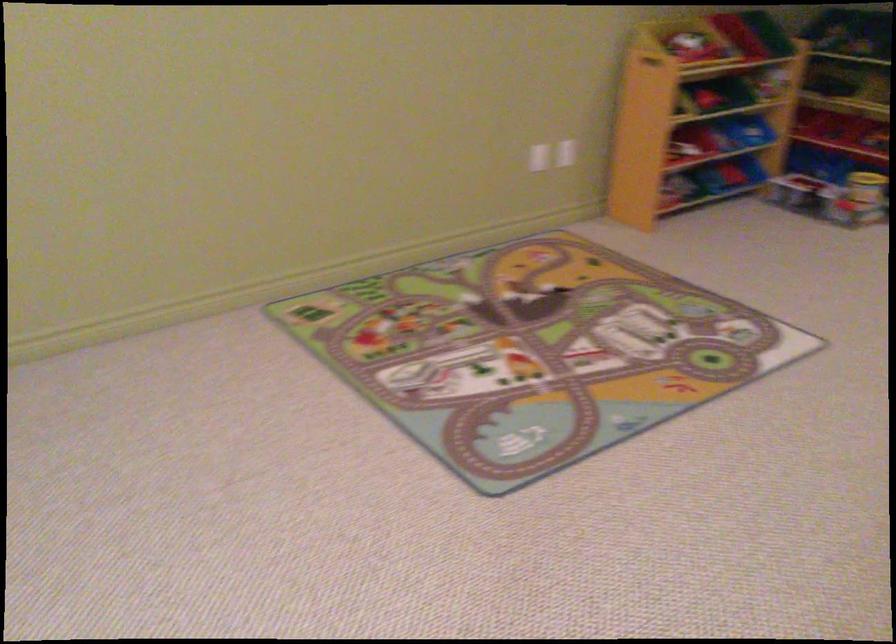
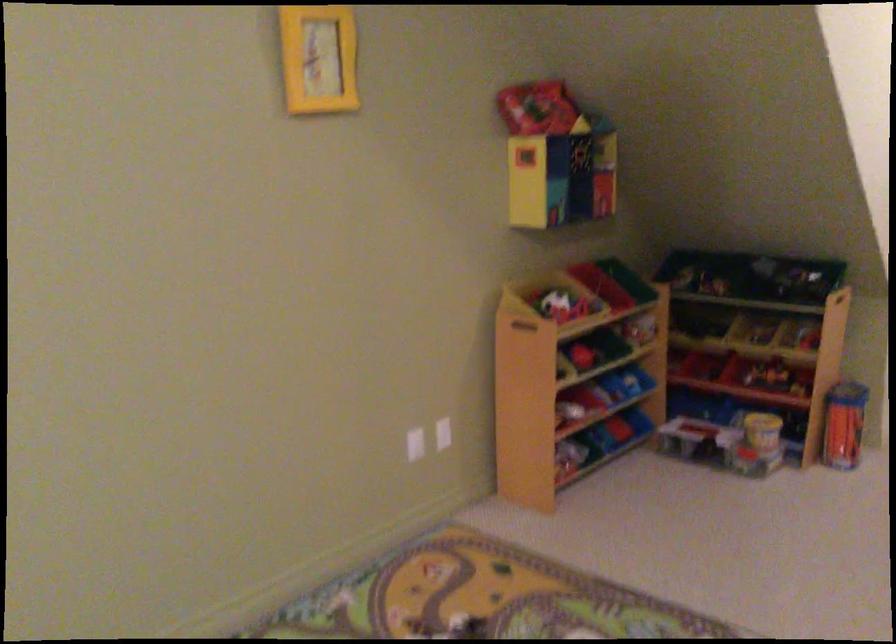
The point at (686, 146) is marked in the first image. Where is the corresponding point in the second image?

(571, 410)